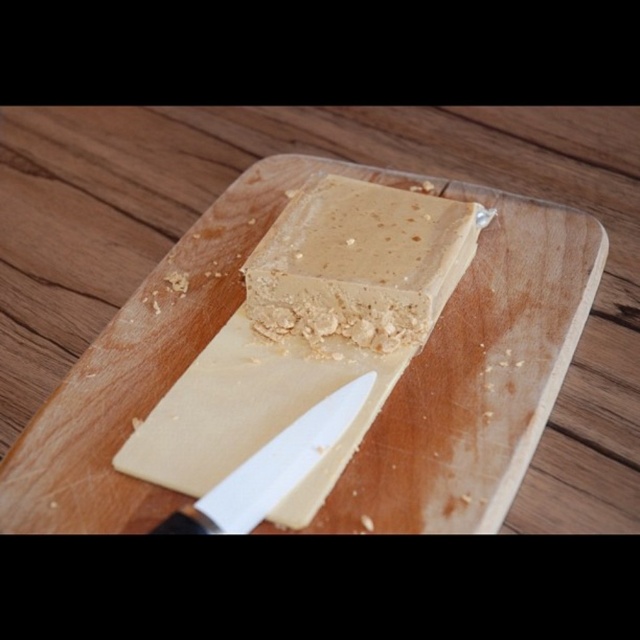
Question: Does wooden cutting board at center appear under golden crumbly dough at center?

Choices:
 (A) yes
 (B) no

Answer: (A)

Question: Does wooden cutting board at center have a greater width compared to golden crumbly dough at center?

Choices:
 (A) yes
 (B) no

Answer: (A)

Question: Which object appears closest to the camera in this image?

Choices:
 (A) white plastic knife at center
 (B) wooden cutting board at center
 (C) golden crumbly dough at center

Answer: (B)

Question: Does wooden cutting board at center have a lesser width compared to golden crumbly dough at center?

Choices:
 (A) yes
 (B) no

Answer: (B)

Question: Which point appears closest to the camera in this image?

Choices:
 (A) (221, 483)
 (B) (280, 248)
 (C) (22, 528)

Answer: (C)

Question: Which object is the closest to the white plastic knife at center?

Choices:
 (A) golden crumbly dough at center
 (B) wooden cutting board at center

Answer: (B)